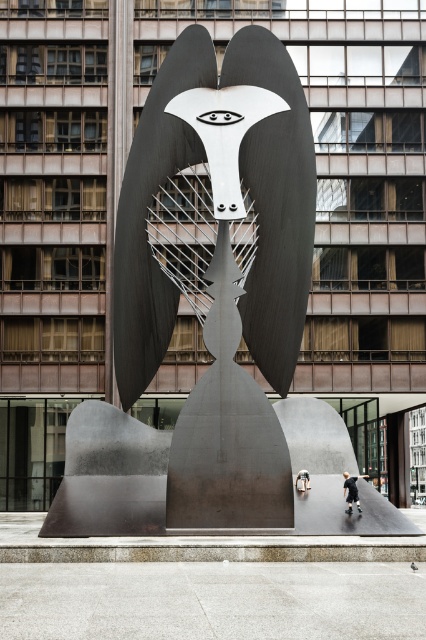
You are an urban planner assessing the space between the polished steel sculpture at center and the metallic silver figure at center. If you want to install a bench that requires 5 meters of clear space between them, is the current spacing sufficient?

The distance between the polished steel sculpture at center and the metallic silver figure at center is 4.33 meters, which is less than the required 5 meters. Therefore, the current spacing is insufficient for installing the bench.

You are an urban planner assessing the space between the polished steel sculpture at center and the metallic silver figure at center. Which object is wider?

The polished steel sculpture at center is wider than the metallic silver figure at center.